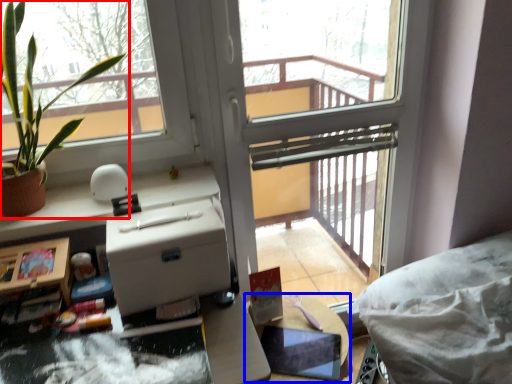
Question: Which object appears farthest to the camera in this image, houseplant (highlighted by a red box) or table (highlighted by a blue box)?

Choices:
 (A) houseplant
 (B) table

Answer: (B)